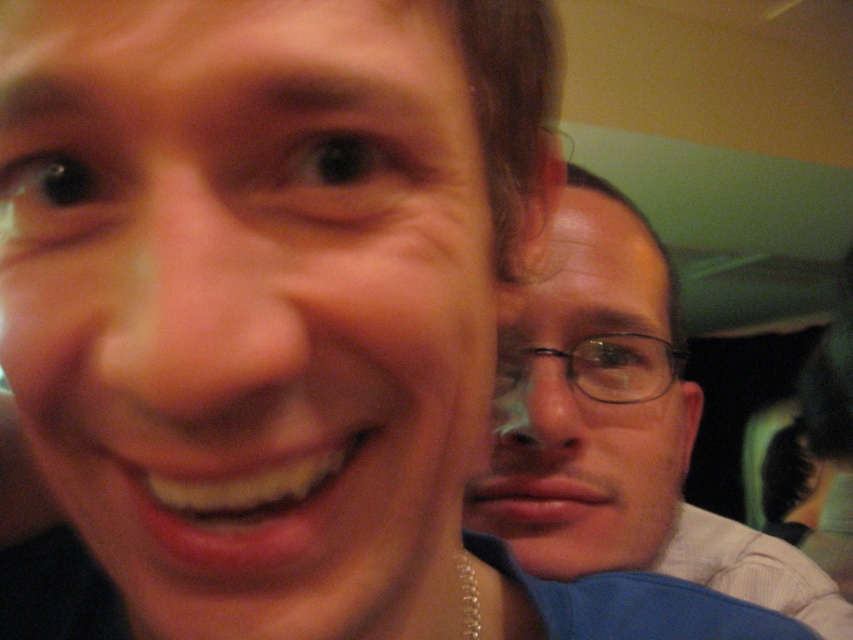
From the picture: Who is shorter, matte black glasses at upper right or matte black glasses at center?

matte black glasses at center is shorter.

Can you confirm if matte black glasses at upper right is wider than matte black glasses at center?

Correct, the width of matte black glasses at upper right exceeds that of matte black glasses at center.

The image size is (853, 640). Describe the element at coordinates (618, 426) in the screenshot. I see `matte black glasses at upper right` at that location.

Locate an element on the screen. The width and height of the screenshot is (853, 640). matte black glasses at upper right is located at coordinates (618, 426).

Can you confirm if matte skin at center is smaller than matte black glasses at center?

Indeed, matte skin at center has a smaller size compared to matte black glasses at center.

The image size is (853, 640). What do you see at coordinates (248, 305) in the screenshot?
I see `matte skin at center` at bounding box center [248, 305].

The height and width of the screenshot is (640, 853). In order to click on matte skin at center in this screenshot , I will do `click(248, 305)`.

Which is behind, point (287, 72) or point (732, 531)?

The point (732, 531) is behind.

Is matte skin at center bigger than matte black glasses at upper right?

Incorrect, matte skin at center is not larger than matte black glasses at upper right.

Does point (160, 180) come in front of point (619, 460)?

That is True.

Identify the location of matte skin at center. Image resolution: width=853 pixels, height=640 pixels. (248, 305).